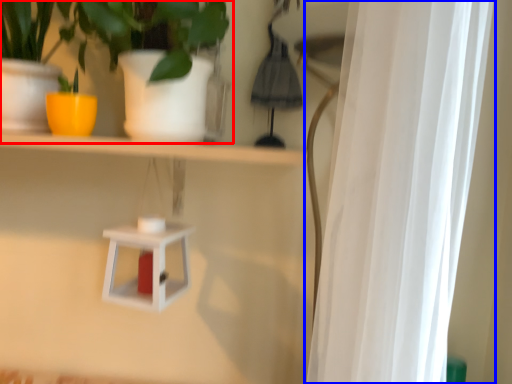
Question: Which object appears closest to the camera in this image, houseplant (highlighted by a red box) or curtain (highlighted by a blue box)?

Choices:
 (A) houseplant
 (B) curtain

Answer: (B)